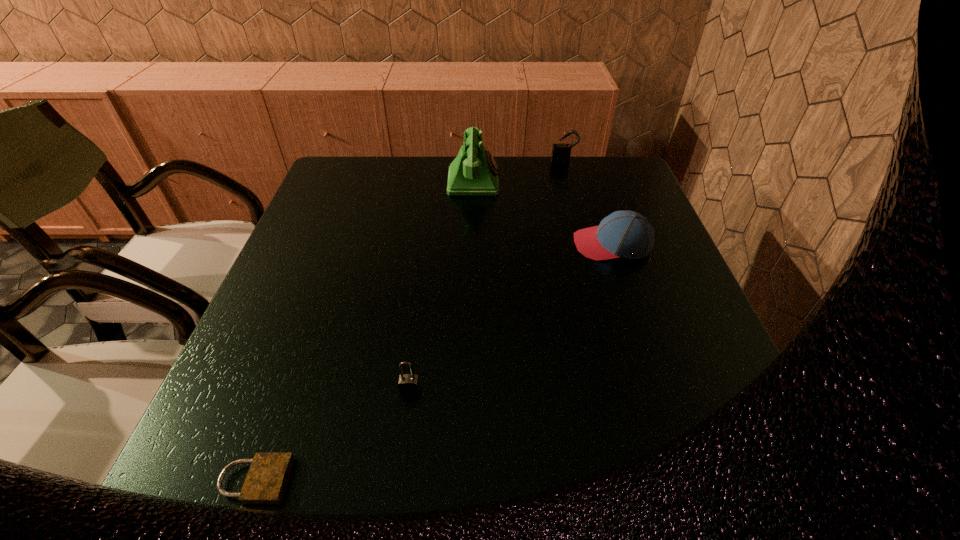
Locate an element on the screen. free space between the telephone and the shortest object is located at coordinates 364,331.

Identify the location of vacant point located between the fourth object from right to left and the shortest object. (332, 435).

Image resolution: width=960 pixels, height=540 pixels. Identify the location of vacant area that lies between the telephone and the leftmost padlock. point(364,331).

You are a GUI agent. You are given a task and a screenshot of the screen. Output one action in this format:
    pyautogui.click(x=<x>, y=<y>)
    Task: Click on the empty space between the third object from left to right and the second object from left to right
    This screenshot has width=960, height=540.
    Given the screenshot: What is the action you would take?
    pyautogui.click(x=442, y=286)

Find the location of `vacant space that's between the third object from left to right and the baseball cap`. vacant space that's between the third object from left to right and the baseball cap is located at coordinates (542, 213).

The image size is (960, 540). What are the coordinates of `blank region between the third nearest object and the leftmost padlock` in the screenshot? It's located at (434, 362).

The image size is (960, 540). I want to click on free spot between the second farthest padlock and the third nearest object, so click(x=511, y=317).

Identify the location of empty space between the fourth object from right to left and the third object from right to left. This screenshot has height=540, width=960. (x=442, y=286).

Where is `object that stands as the fourth closest to the second padlock from right to left`? object that stands as the fourth closest to the second padlock from right to left is located at coordinates (561, 153).

Select which object appears as the second closest to the rightmost padlock. Please provide its 2D coordinates. Your answer should be formatted as a tuple, i.e. [(x, y)], where the tuple contains the x and y coordinates of a point satisfying the conditions above.

[(624, 233)]